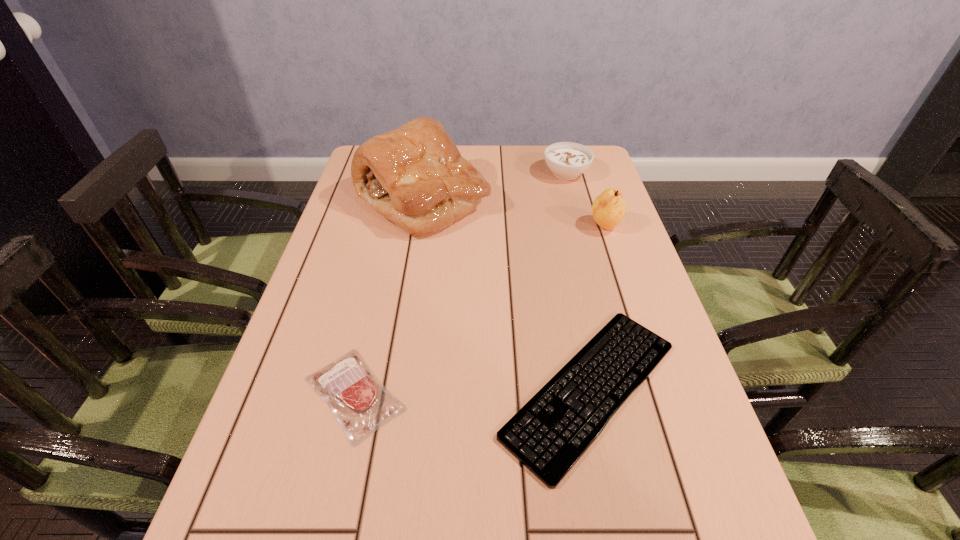
Locate which object ranks second in proximity to the fourth shortest object. Please provide its 2D coordinates. Your answer should be formatted as a tuple, i.e. [(x, y)], where the tuple contains the x and y coordinates of a point satisfying the conditions above.

[(414, 176)]

Image resolution: width=960 pixels, height=540 pixels. I want to click on vacant position in the image that satisfies the following two spatial constraints: 1. on the filling side of the tallest object; 2. on the left side of the fourth shortest object, so click(419, 227).

This screenshot has height=540, width=960. Identify the location of vacant space that satisfies the following two spatial constraints: 1. on the back side of the fourth shortest object; 2. on the filling side of the tallest object. (596, 200).

Locate an element on the screen. This screenshot has height=540, width=960. vacant position in the image that satisfies the following two spatial constraints: 1. on the filling side of the shortest object; 2. on the left side of the tallest object is located at coordinates (392, 389).